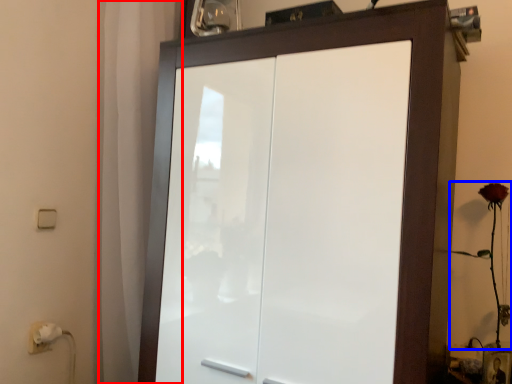
Question: Which object is closer to the camera taking this photo, curtain (highlighted by a red box) or flower (highlighted by a blue box)?

Choices:
 (A) curtain
 (B) flower

Answer: (B)